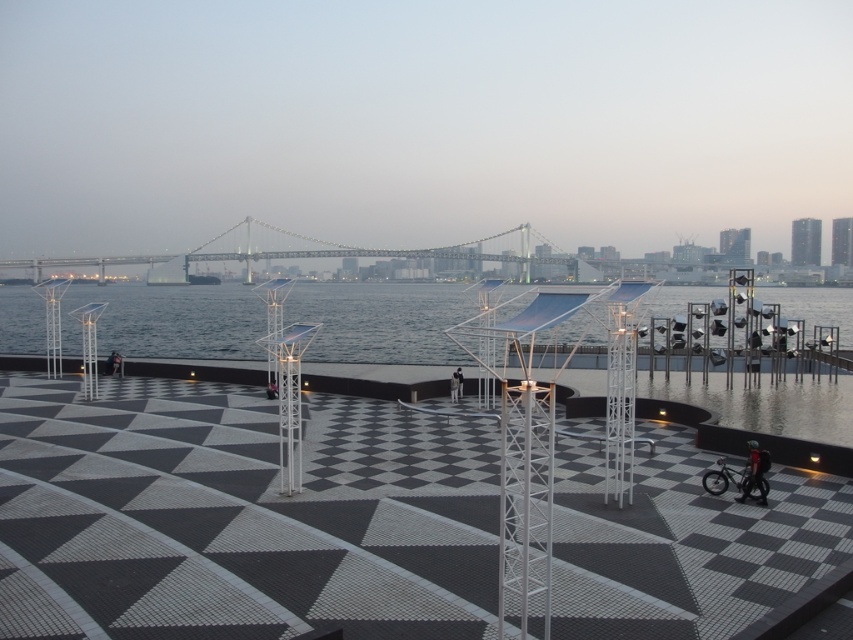
Can you confirm if dark blue fabric jacket at lower right is thinner than dark gray fabric jacket at center?

No, dark blue fabric jacket at lower right is not thinner than dark gray fabric jacket at center.

Consider the image. Between dark blue fabric jacket at lower right and dark gray fabric jacket at center, which one appears on the right side from the viewer's perspective?

dark blue fabric jacket at lower right is more to the right.

Does point (747, 444) come closer to viewer compared to point (453, 378)?

Yes, it is.

What are the coordinates of `dark blue fabric jacket at lower right` in the screenshot? It's located at (755, 472).

What do you see at coordinates (239, 515) in the screenshot? I see `black textured tiles at center` at bounding box center [239, 515].

Looking at this image, can you confirm if black textured tiles at center is positioned above dark blue fabric jacket at lower right?

No.

Locate an element on the screen. black textured tiles at center is located at coordinates (239, 515).

Who is positioned more to the left, transparent glass water at center or metallic gray bridge at center?

Positioned to the left is metallic gray bridge at center.

Who is more forward, (773, 294) or (320, 244)?

Point (773, 294)

Identify the location of transparent glass water at center. [381, 321].